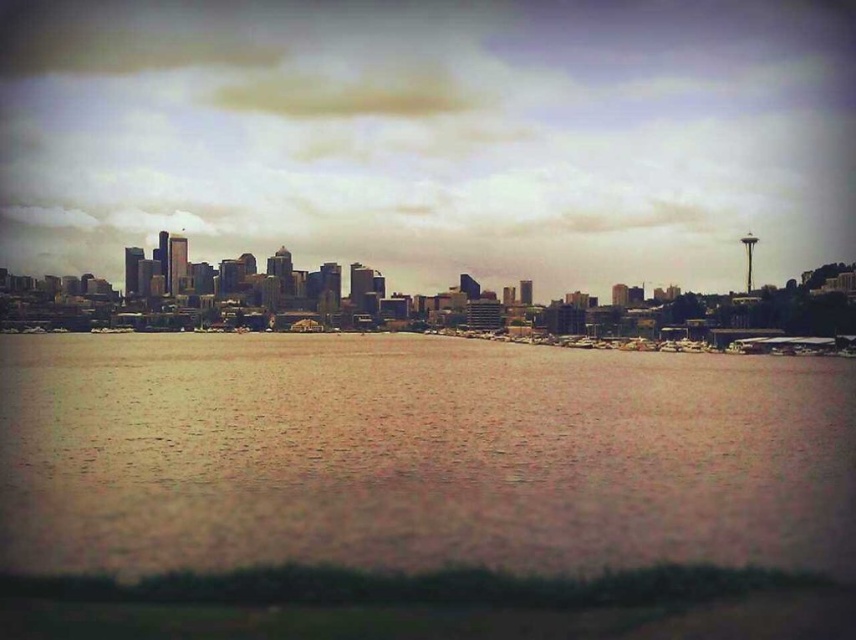
Question: Which object appears farthest from the camera in this image?

Choices:
 (A) metallic gray boats at center
 (B) brown water at center

Answer: (A)

Question: Does brown water at center appear on the left side of metallic gray boats at center?

Choices:
 (A) yes
 (B) no

Answer: (A)

Question: Can you confirm if brown water at center is smaller than metallic gray boats at center?

Choices:
 (A) no
 (B) yes

Answer: (A)

Question: Can you confirm if brown water at center is positioned to the right of metallic gray boats at center?

Choices:
 (A) yes
 (B) no

Answer: (B)

Question: Which point is closer to the camera?

Choices:
 (A) (602, 344)
 (B) (474, 563)

Answer: (B)